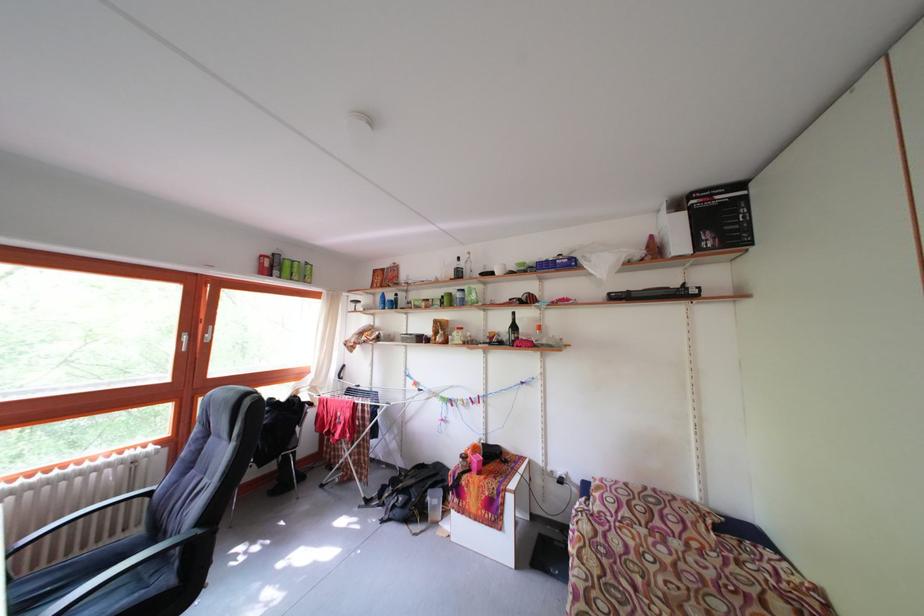
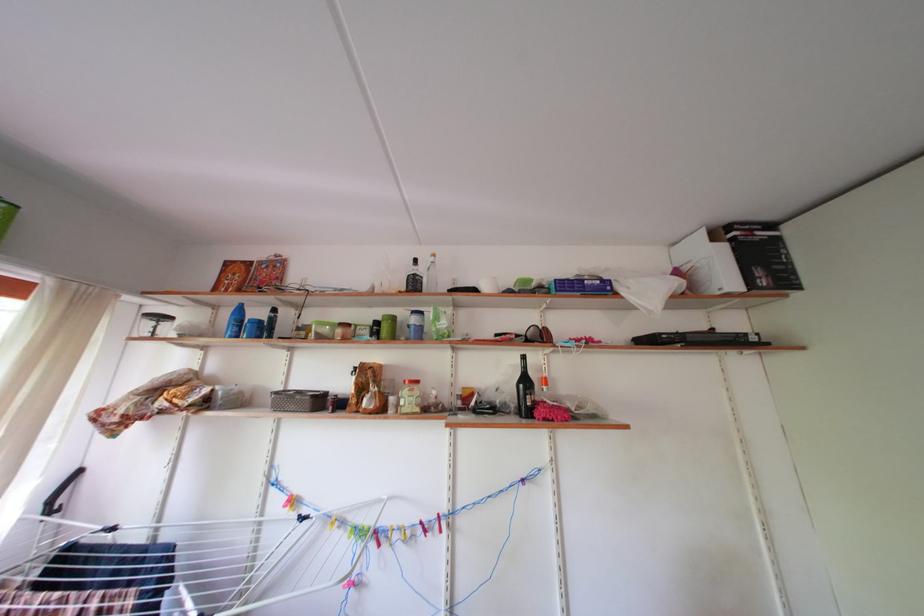
Find the pixel in the second image that matches (x=523, y=333) in the first image.

(533, 387)